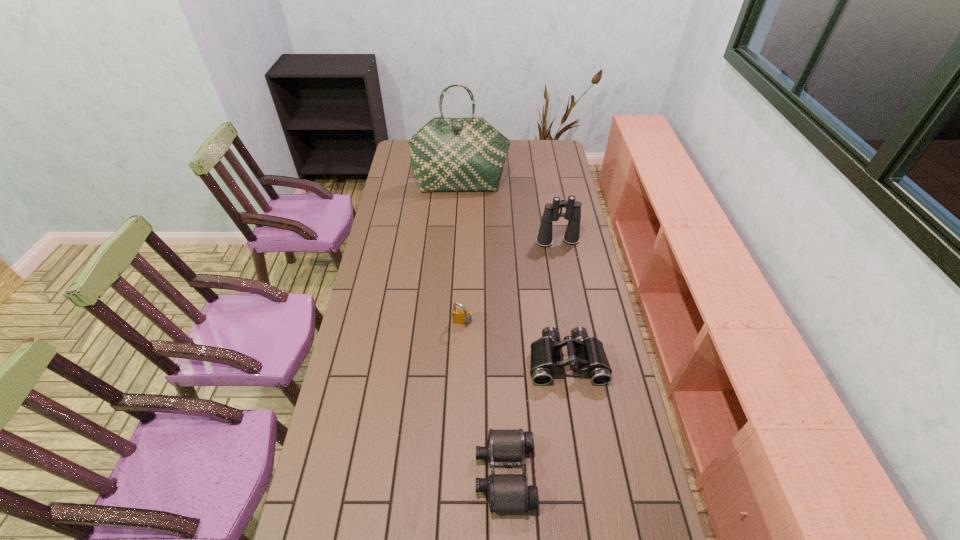
Locate an element on the screen. the tallest object is located at coordinates (447, 154).

Identify the location of tote bag. (447, 154).

Where is `the second tallest object`? This screenshot has width=960, height=540. the second tallest object is located at coordinates (551, 213).

Find the location of a particular element. the fourth nearest object is located at coordinates (551, 213).

This screenshot has height=540, width=960. Find the location of `the third tallest object`. the third tallest object is located at coordinates (459, 316).

I want to click on padlock, so click(459, 316).

Where is `the second nearest object`? This screenshot has height=540, width=960. the second nearest object is located at coordinates (588, 353).

This screenshot has width=960, height=540. What are the coordinates of `the second farthest binoculars` in the screenshot? It's located at (588, 353).

Locate an element on the screen. the nearest binoculars is located at coordinates (505, 448).

Where is `the shortest object`? Image resolution: width=960 pixels, height=540 pixels. the shortest object is located at coordinates (505, 448).